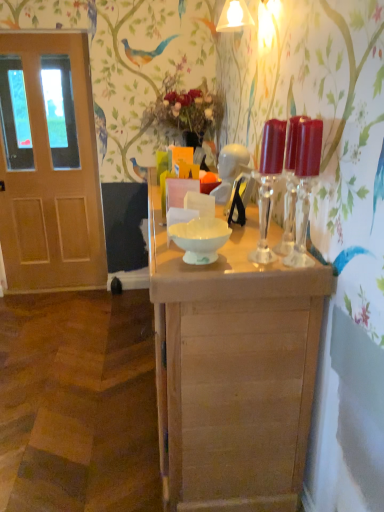
Question: Considering the relative sizes of transparent glass candle holders at center, placed as the 2th candle holder when sorted from right to left, and translucent glass candle holders at right, positioned as the 1th candle holder in right-to-left order, in the image provided, is transparent glass candle holders at center, placed as the 2th candle holder when sorted from right to left, bigger than translucent glass candle holders at right, positioned as the 1th candle holder in right-to-left order,?

Choices:
 (A) yes
 (B) no

Answer: (A)

Question: Considering the relative sizes of transparent glass candle holders at center, placed as the 2th candle holder when sorted from right to left, and translucent glass candle holders at right, which is counted as the 2th candle holder, starting from the left, in the image provided, is transparent glass candle holders at center, placed as the 2th candle holder when sorted from right to left, thinner than translucent glass candle holders at right, which is counted as the 2th candle holder, starting from the left,?

Choices:
 (A) yes
 (B) no

Answer: (B)

Question: Is transparent glass candle holders at center, marked as the 1th candle holder in a left-to-right arrangement, oriented towards translucent glass candle holders at right, which is counted as the 2th candle holder, starting from the left?

Choices:
 (A) yes
 (B) no

Answer: (B)

Question: Is transparent glass candle holders at center, placed as the 2th candle holder when sorted from right to left, further to the viewer compared to translucent glass candle holders at right, positioned as the 1th candle holder in right-to-left order?

Choices:
 (A) yes
 (B) no

Answer: (A)

Question: Does transparent glass candle holders at center, placed as the 2th candle holder when sorted from right to left, touch translucent glass candle holders at right, which is counted as the 2th candle holder, starting from the left?

Choices:
 (A) no
 (B) yes

Answer: (A)

Question: Considering their positions, is transparent glass candle holders at center, marked as the 1th candle holder in a left-to-right arrangement, located in front of or behind wooden door at left?

Choices:
 (A) behind
 (B) front

Answer: (B)

Question: Considering the positions of transparent glass candle holders at center, placed as the 2th candle holder when sorted from right to left, and wooden door at left in the image, is transparent glass candle holders at center, placed as the 2th candle holder when sorted from right to left, wider or thinner than wooden door at left?

Choices:
 (A) thin
 (B) wide

Answer: (A)

Question: From the image's perspective, is transparent glass candle holders at center, placed as the 2th candle holder when sorted from right to left, positioned above or below wooden door at left?

Choices:
 (A) above
 (B) below

Answer: (B)

Question: From a real-world perspective, is transparent glass candle holders at center, placed as the 2th candle holder when sorted from right to left, positioned above or below wooden door at left?

Choices:
 (A) below
 (B) above

Answer: (B)

Question: Looking at their shapes, would you say white glossy bowl at center is wider or thinner than light brown wooden table at center?

Choices:
 (A) thin
 (B) wide

Answer: (A)

Question: Would you say white glossy bowl at center is to the left or to the right of light brown wooden table at center in the picture?

Choices:
 (A) right
 (B) left

Answer: (B)

Question: Based on their sizes in the image, would you say white glossy bowl at center is bigger or smaller than light brown wooden table at center?

Choices:
 (A) big
 (B) small

Answer: (B)

Question: Considering the positions of point (200, 247) and point (180, 352), is point (200, 247) closer or farther from the camera than point (180, 352)?

Choices:
 (A) closer
 (B) farther

Answer: (A)

Question: Is light brown wooden table at center bigger or smaller than white glossy bowl at center?

Choices:
 (A) small
 (B) big

Answer: (B)

Question: In terms of height, does light brown wooden table at center look taller or shorter compared to white glossy bowl at center?

Choices:
 (A) short
 (B) tall

Answer: (B)